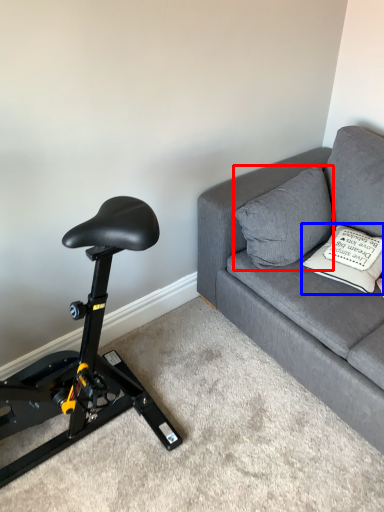
Question: Which of the following is the closest to the observer, pillow (highlighted by a red box) or pillow (highlighted by a blue box)?

Choices:
 (A) pillow
 (B) pillow

Answer: (B)